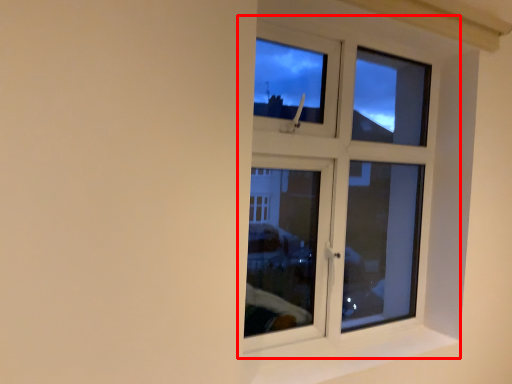
Question: From the image's perspective, where is window (annotated by the red box) located relative to window sill?

Choices:
 (A) above
 (B) below

Answer: (A)